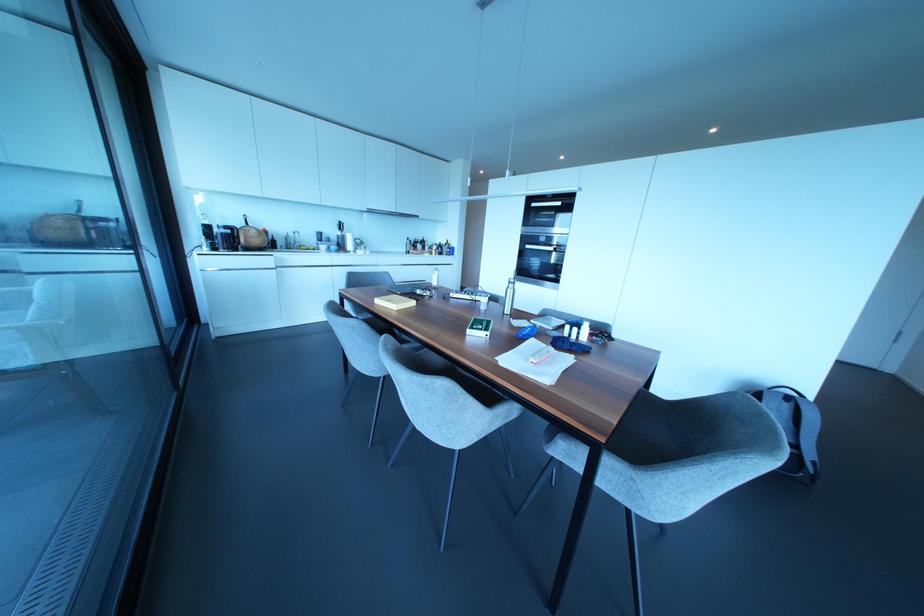
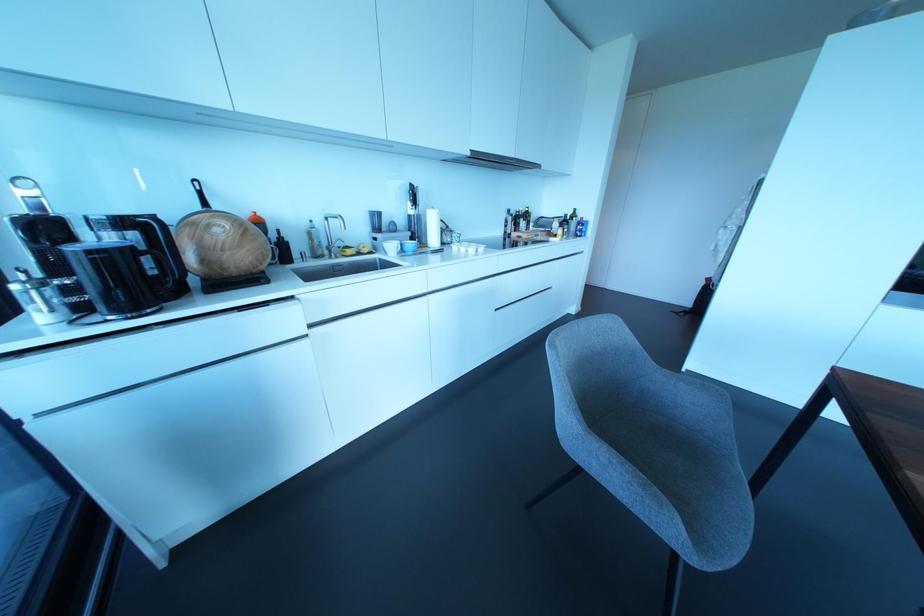
Question: I am providing you with two images of the same scene from different viewpoints. Which of the following objects are not visible in image2?

Choices:
 (A) grey chair sitting surface
 (B) grey chair armrest
 (C) small white cup
 (D) none of these

Answer: (D)